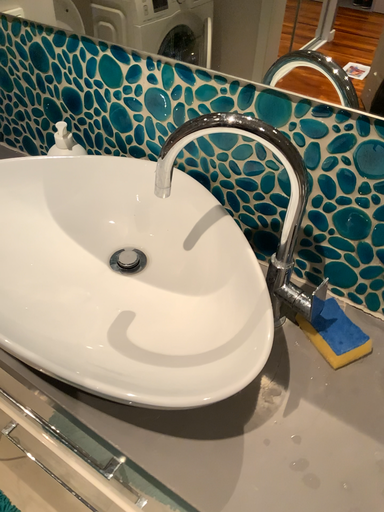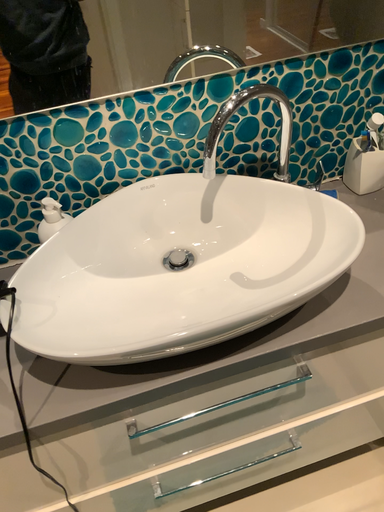
Question: Which way did the camera rotate in the video?

Choices:
 (A) rotated downward
 (B) rotated upward

Answer: (B)